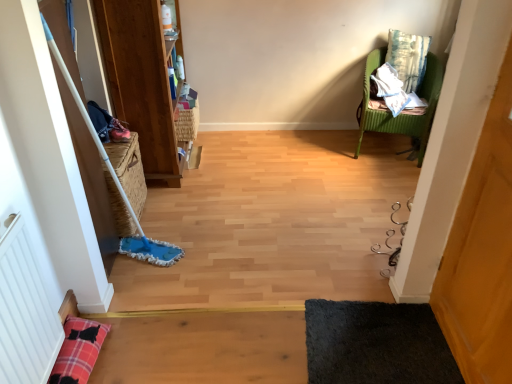
You are a GUI agent. You are given a task and a screenshot of the screen. Output one action in this format:
    pyautogui.click(x=<x>, y=<y>)
    Task: Click on the blank space situated above black shaggy rug at lower right (from a real-world perspective)
    The image size is (512, 384).
    Given the screenshot: What is the action you would take?
    pyautogui.click(x=379, y=337)